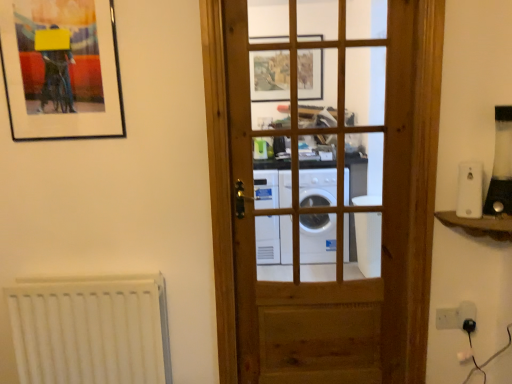
Question: Is black plastic blender at right, the second appliance from the left, taller than white plastic light switch at lower right?

Choices:
 (A) yes
 (B) no

Answer: (A)

Question: Is black plastic blender at right, the second appliance from the left, at the right side of white plastic light switch at lower right?

Choices:
 (A) no
 (B) yes

Answer: (B)

Question: Considering the relative sizes of black plastic blender at right, the second appliance from the left, and white plastic light switch at lower right in the image provided, is black plastic blender at right, the second appliance from the left, smaller than white plastic light switch at lower right?

Choices:
 (A) yes
 (B) no

Answer: (B)

Question: Is black plastic blender at right, marked as the 1th appliance in a right-to-left arrangement, bigger than white plastic light switch at lower right?

Choices:
 (A) no
 (B) yes

Answer: (B)

Question: From the image's perspective, would you say black plastic blender at right, the second appliance from the left, is shown under white plastic light switch at lower right?

Choices:
 (A) yes
 (B) no

Answer: (B)

Question: From the image's perspective, would you say black plastic blender at right, the second appliance from the left, is positioned over white plastic light switch at lower right?

Choices:
 (A) yes
 (B) no

Answer: (A)

Question: From the image's perspective, is white plastic electric outlet at lower right beneath wooden door at center?

Choices:
 (A) no
 (B) yes

Answer: (B)

Question: Can you confirm if white plastic electric outlet at lower right is shorter than wooden door at center?

Choices:
 (A) yes
 (B) no

Answer: (A)

Question: Is white plastic electric outlet at lower right looking in the opposite direction of wooden door at center?

Choices:
 (A) no
 (B) yes

Answer: (A)

Question: Is white plastic electric outlet at lower right not within wooden door at center?

Choices:
 (A) no
 (B) yes

Answer: (B)

Question: Is white plastic electric outlet at lower right to the left of wooden door at center from the viewer's perspective?

Choices:
 (A) no
 (B) yes

Answer: (A)

Question: Can you confirm if white plastic electric outlet at lower right is smaller than wooden door at center?

Choices:
 (A) yes
 (B) no

Answer: (A)

Question: Can you confirm if white plastic light switch at lower right is positioned to the right of white plastic electric outlet at lower right?

Choices:
 (A) yes
 (B) no

Answer: (B)